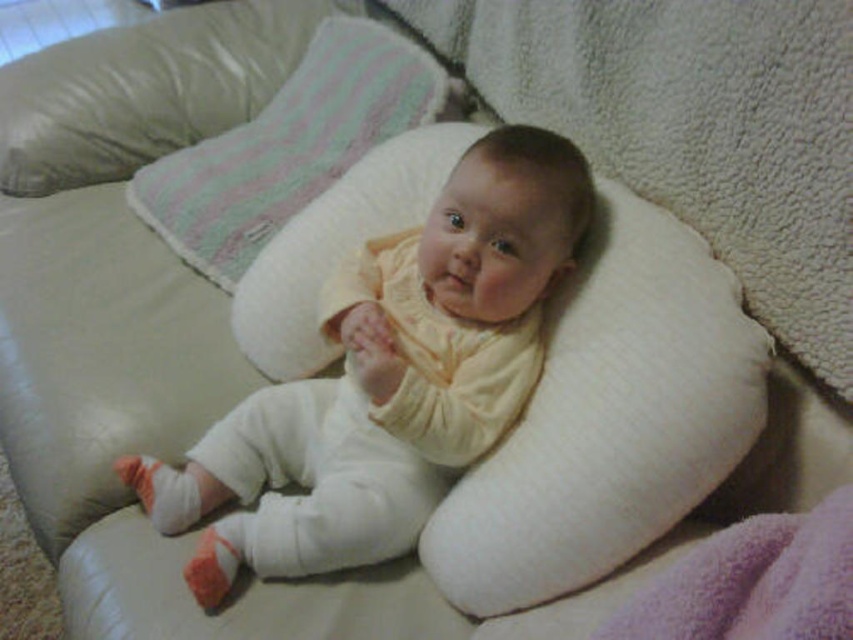
Is point (403, 416) positioned before point (403, 52)?

Yes, point (403, 416) is closer to viewer.

Who is shorter, soft yellow fabric baby at center or white soft pillow at upper center?

white soft pillow at upper center is shorter.

The height and width of the screenshot is (640, 853). I want to click on soft yellow fabric baby at center, so click(389, 378).

What do you see at coordinates (389, 378) in the screenshot? I see `soft yellow fabric baby at center` at bounding box center [389, 378].

Measure the distance between point [367,509] and camera.

They are 1.04 meters apart.

Is point (408, 282) positioned behind point (851, 614)?

That is True.

Find the location of `soft yellow fabric baby at center`. soft yellow fabric baby at center is located at coordinates (389, 378).

Between white fleece pillow at center and white soft pillow at upper center, which one appears on the right side from the viewer's perspective?

white fleece pillow at center

You are a GUI agent. You are given a task and a screenshot of the screen. Output one action in this format:
    pyautogui.click(x=<x>, y=<y>)
    Task: Click on the white fleece pillow at center
    
    Given the screenshot: What is the action you would take?
    pyautogui.click(x=695, y=128)

Who is more forward, [622,38] or [259,134]?

Positioned in front is point [622,38].

Find the location of a particular element. white fleece pillow at center is located at coordinates (695, 128).